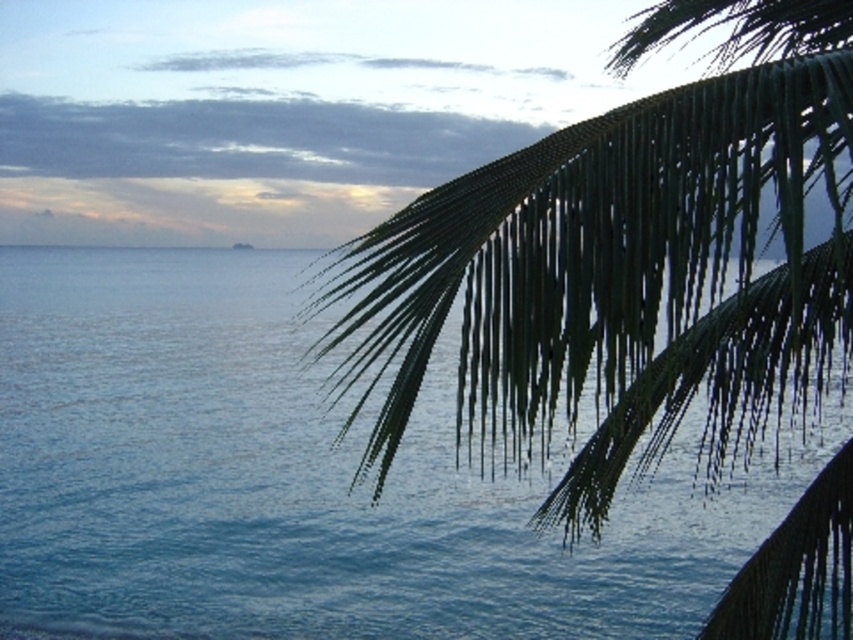
Question: Which point is farther to the camera?

Choices:
 (A) (372, 588)
 (B) (722, 205)

Answer: (A)

Question: Which of the following is the farthest from the observer?

Choices:
 (A) (422, 580)
 (B) (529, 413)

Answer: (A)

Question: Which of the following is the closest to the observer?

Choices:
 (A) (786, 333)
 (B) (173, 538)

Answer: (A)

Question: Is blue water at center positioned at the back of green leafy palm at upper right?

Choices:
 (A) no
 (B) yes

Answer: (B)

Question: Does blue water at center have a smaller size compared to green leafy palm at upper right?

Choices:
 (A) yes
 (B) no

Answer: (B)

Question: Does blue water at center have a lesser width compared to green leafy palm at upper right?

Choices:
 (A) yes
 (B) no

Answer: (B)